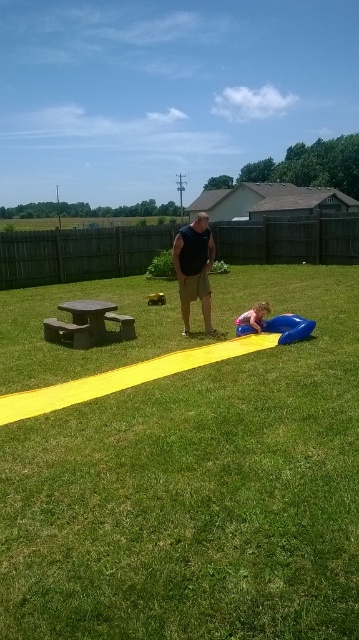
Question: Can you confirm if green grass at center is positioned to the left of blue rubber pool at lower center?

Choices:
 (A) no
 (B) yes

Answer: (B)

Question: Is matte black tank top at center bigger than smooth pink ball at lower center?

Choices:
 (A) no
 (B) yes

Answer: (B)

Question: Which point is closer to the camera?

Choices:
 (A) matte black tank top at center
 (B) gray concrete picnic table at left
 (C) blue rubber pool at lower center

Answer: (A)

Question: Among these points, which one is farthest from the camera?

Choices:
 (A) (56, 332)
 (B) (184, 253)

Answer: (A)

Question: Among these points, which one is farthest from the camera?

Choices:
 (A) (274, 324)
 (B) (100, 333)
 (C) (263, 304)
 (D) (188, 312)

Answer: (A)

Question: Is gray concrete picnic table at left bigger than smooth pink ball at lower center?

Choices:
 (A) no
 (B) yes

Answer: (B)